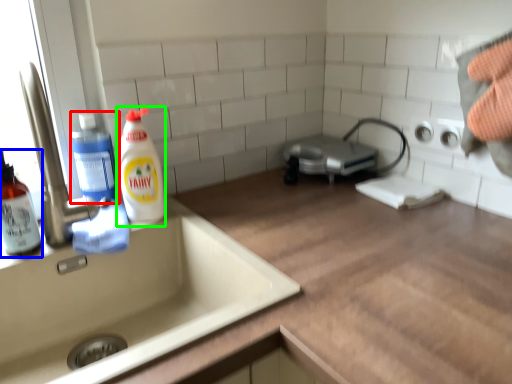
Question: Which object is the closest to the cleaning product (highlighted by a red box)? Choose among these: cleaning product (highlighted by a blue box) or cleaning product (highlighted by a green box).

Choices:
 (A) cleaning product
 (B) cleaning product

Answer: (B)